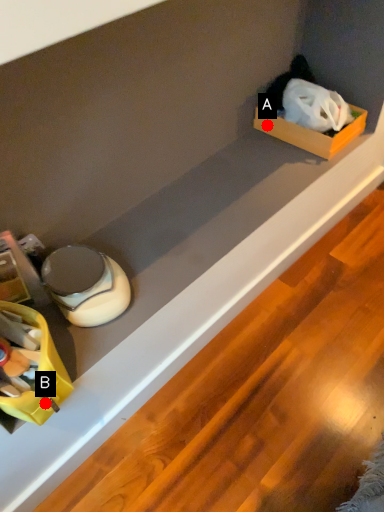
Question: Two points are circled on the image, labeled by A and B beside each circle. Which point appears closest to the camera in this image?

Choices:
 (A) A is closer
 (B) B is closer

Answer: (B)